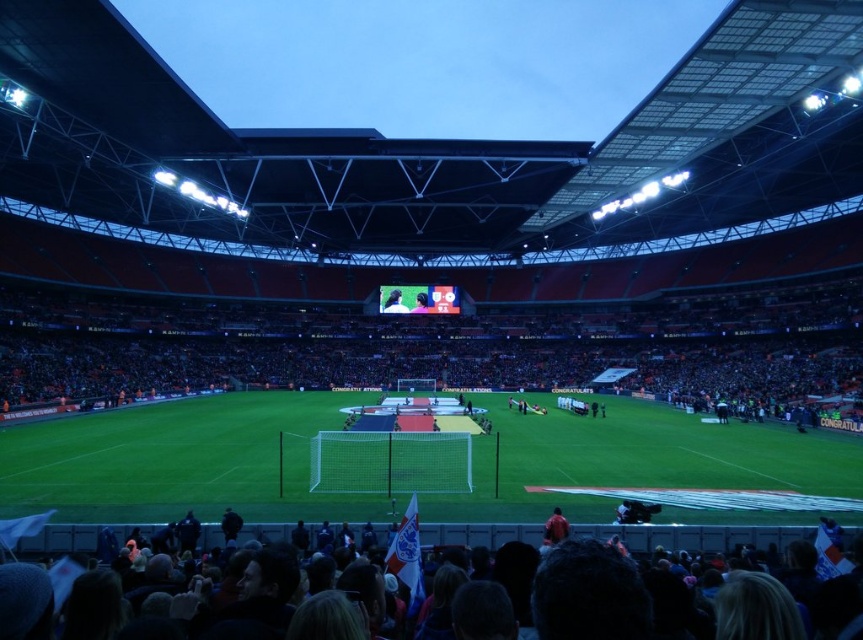
You are a photographer positioned at the back of the stadium. You need to capture a photo of both the green fabric jacket at lower right and the smooth black shirt at center. Based on their positions, which one should you focus on first to ensure both are in the frame?

The green fabric jacket at lower right is below the smooth black shirt at center, so you should focus on the smooth black shirt at center first to ensure both are in the frame.

You are a photographer positioned at the edge of the field. You need to capture a photo that includes both the green grass football field at center and the smooth black shirt at center. Based on their positions, which object should appear higher in the photo?

The smooth black shirt at center appears higher in the photo because the green grass football field at center is located below it.

You are a photographer standing at the edge of the field in the stadium. You want to take a photo that includes both the point at coordinates point (507,416) and point (471,529). Which point should you focus on first to ensure both are in focus?

You should focus on point (507,416) first because it is closer to you than point (471,529), ensuring both points are within the depth of field.